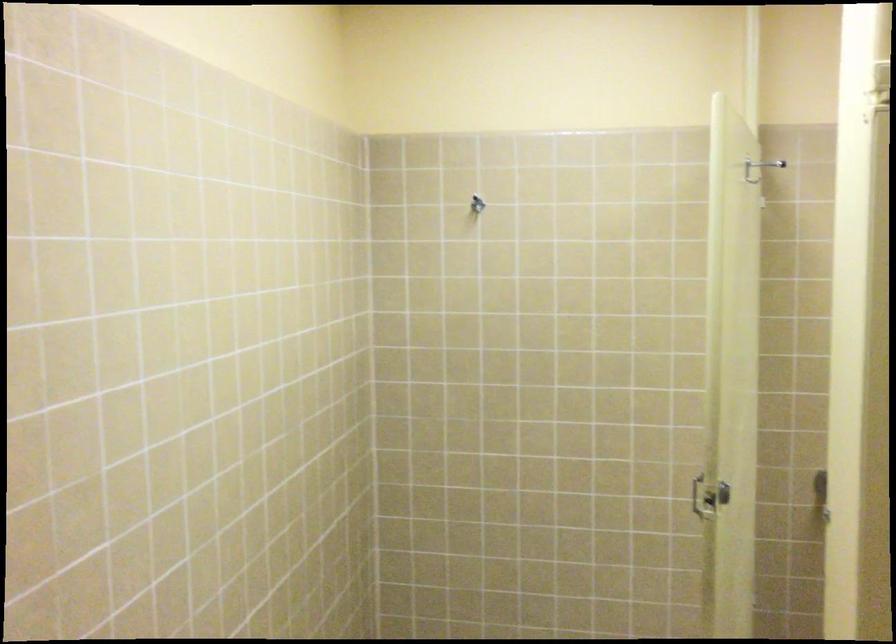
The images are taken continuously from a first-person perspective. In which direction is your viewpoint rotating?

The camera's rotation is toward left-down.